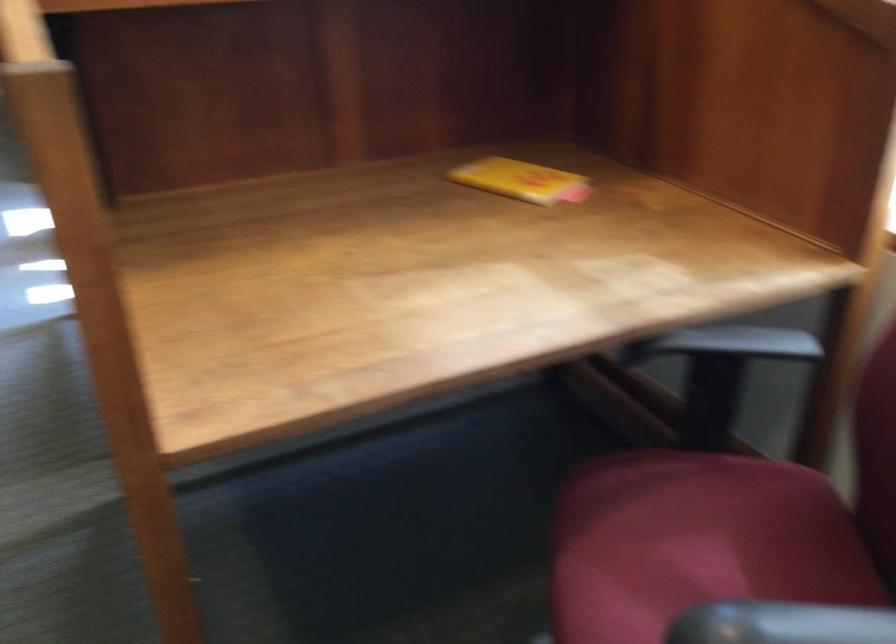
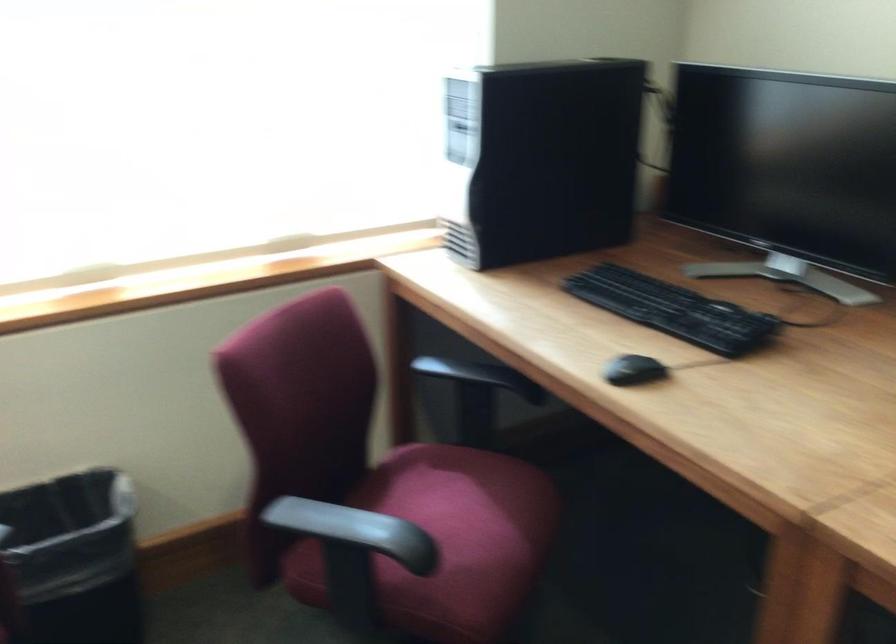
How did the camera likely rotate?

The rotation direction of the camera is right-down.